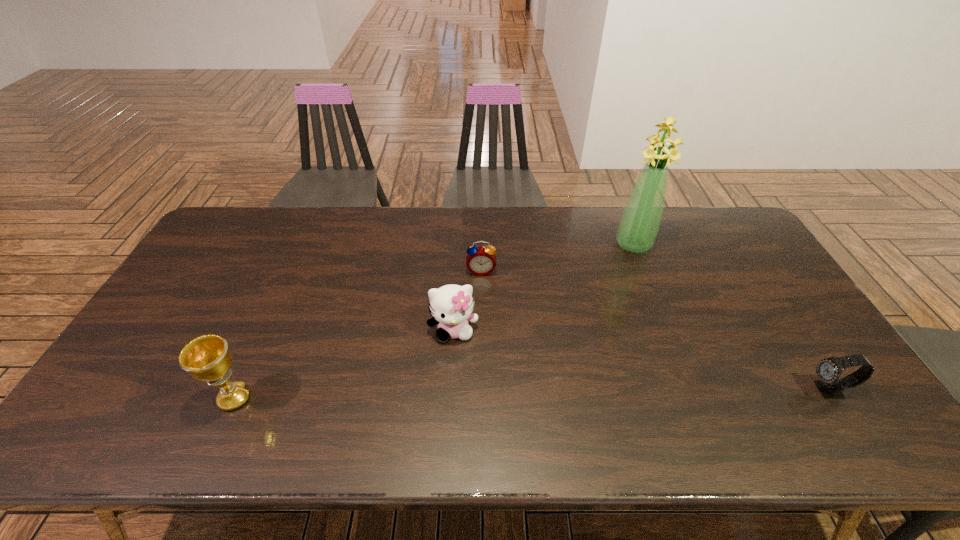
Image resolution: width=960 pixels, height=540 pixels. Identify the location of the third closest object to the kitten. (639, 224).

The height and width of the screenshot is (540, 960). Find the location of `object identified as the fourth closest to the farthest object`. object identified as the fourth closest to the farthest object is located at coordinates (207, 358).

Where is `blank area in the image that satisfies the following two spatial constraints: 1. on the front side of the alarm clock; 2. on the face of the rightmost object`? This screenshot has height=540, width=960. blank area in the image that satisfies the following two spatial constraints: 1. on the front side of the alarm clock; 2. on the face of the rightmost object is located at coordinates (482, 390).

This screenshot has width=960, height=540. I want to click on free space that satisfies the following two spatial constraints: 1. on the front side of the rightmost object; 2. on the face of the kitten, so click(449, 390).

This screenshot has width=960, height=540. In order to click on free region that satisfies the following two spatial constraints: 1. on the back side of the leftmost object; 2. on the face of the watch in this screenshot , I will do tap(238, 390).

Identify the location of vacant space that satisfies the following two spatial constraints: 1. on the front side of the second object from right to left; 2. on the face of the watch. The height and width of the screenshot is (540, 960). (689, 390).

I want to click on vacant space that satisfies the following two spatial constraints: 1. on the back side of the rightmost object; 2. on the face of the chalice, so pos(238,390).

The width and height of the screenshot is (960, 540). I want to click on free location that satisfies the following two spatial constraints: 1. on the front side of the third tallest object; 2. on the face of the rightmost object, so click(449, 390).